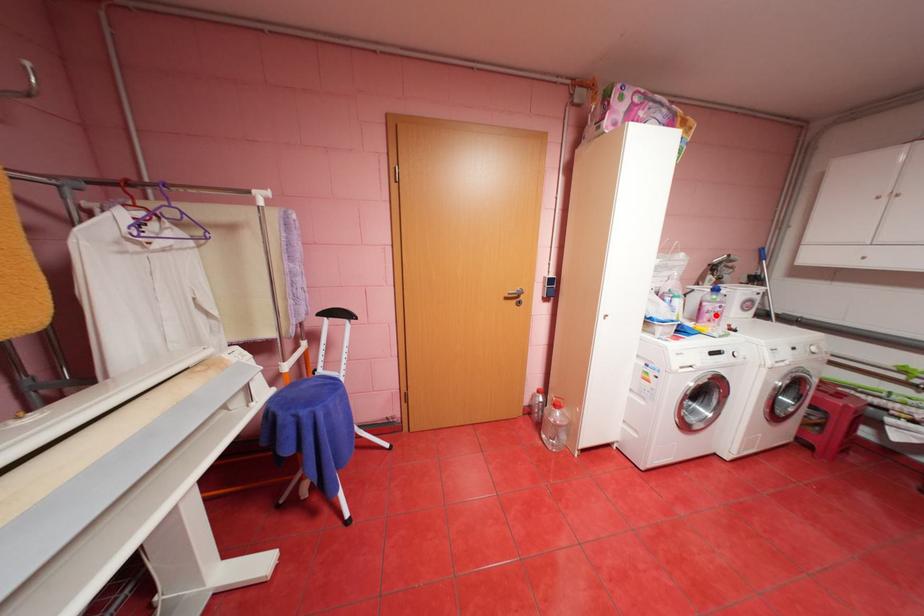
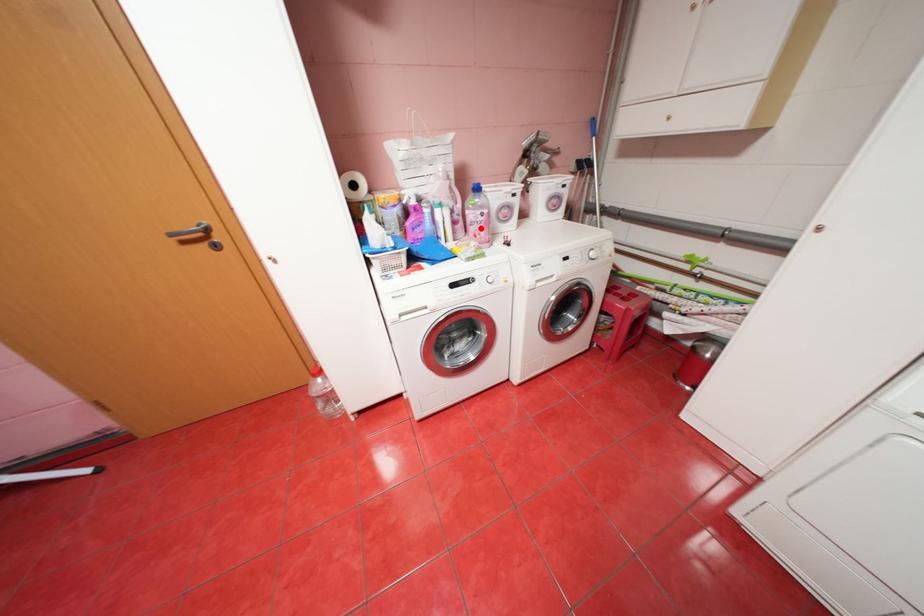
I am providing you with two images of the same scene from different viewpoints. A red point is marked on the first image and another point is marked on the second image. Do the highlighted points in image1 and image2 indicate the same real-world spot?

Yes